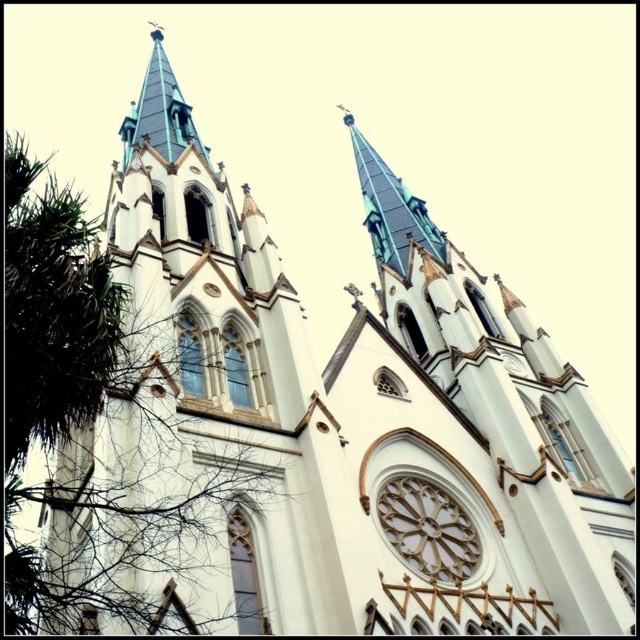
You are standing in front of the Gothic church and want to take a photo. You notice the white stone tower at center and the green leafy tree at left. Which object should you focus on if you want to capture the smaller one in your shot?

The white stone tower at center has a smaller size compared to the green leafy tree at left, so you should focus on the white stone tower at center to capture the smaller one in your shot.

You are standing at the camera position and want to take a photo of the white stone tower at center. The camera has a maximum zoom range of 100 feet. Can you capture the entire tower in the photo without moving closer?

The white stone tower at center and camera are 179.25 feet apart, which exceeds the camera maximum zoom range of 100 feet. Therefore, you cannot capture the entire tower in the photo without moving closer.